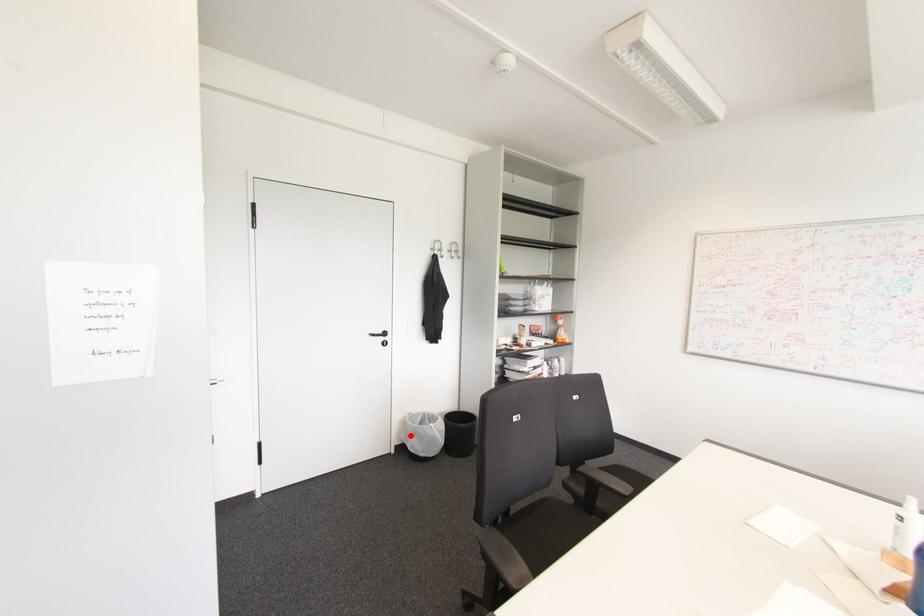
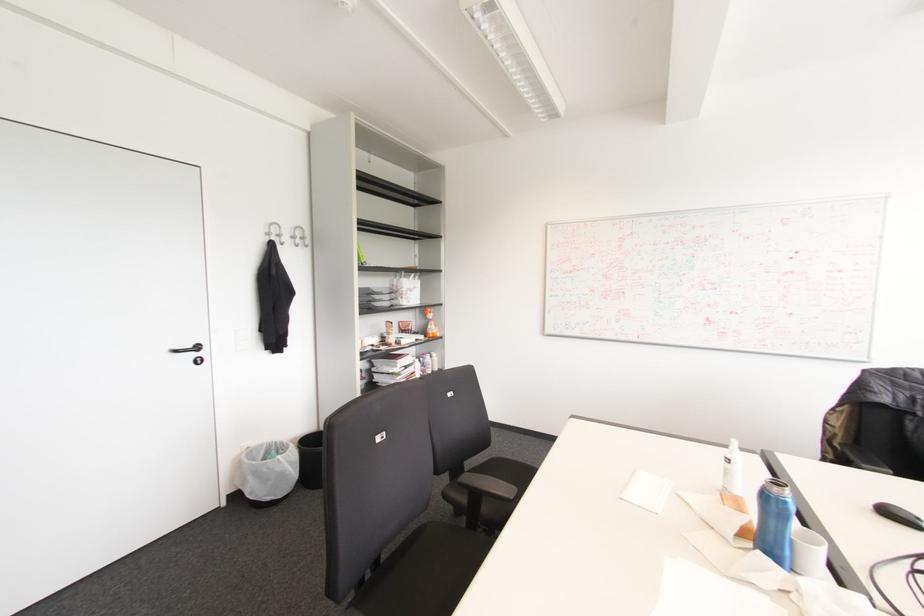
Find the pixel in the second image that matches the highlighted location in the first image.

(249, 477)